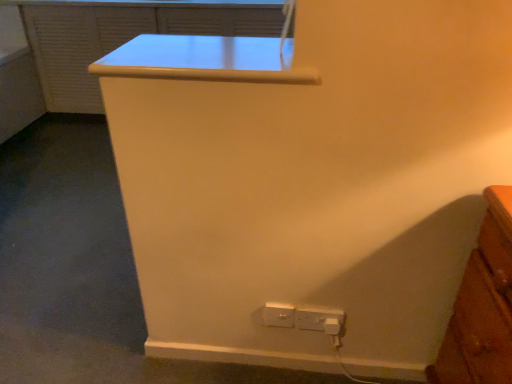
Question: Is matte white file cabinet at upper center placed right next to white plastic power plugs and sockets at lower center, acting as the first power plugs and sockets starting from the left?

Choices:
 (A) no
 (B) yes

Answer: (A)

Question: From the image's perspective, is matte white file cabinet at upper center on white plastic power plugs and sockets at lower center, acting as the first power plugs and sockets starting from the left?

Choices:
 (A) yes
 (B) no

Answer: (A)

Question: From a real-world perspective, is matte white file cabinet at upper center beneath white plastic power plugs and sockets at lower center, acting as the first power plugs and sockets starting from the left?

Choices:
 (A) no
 (B) yes

Answer: (A)

Question: Considering the relative positions of matte white file cabinet at upper center and white plastic power plugs and sockets at lower center, acting as the first power plugs and sockets starting from the left, in the image provided, is matte white file cabinet at upper center to the right of white plastic power plugs and sockets at lower center, acting as the first power plugs and sockets starting from the left, from the viewer's perspective?

Choices:
 (A) no
 (B) yes

Answer: (A)

Question: Is matte white file cabinet at upper center outside white plastic power plugs and sockets at lower center, positioned as the second power plugs and sockets in right-to-left order?

Choices:
 (A) no
 (B) yes

Answer: (B)

Question: From a real-world perspective, is white plastic power plugs and sockets at lower right, which is counted as the first power plugs and sockets, starting from the right, positioned above or below white plastic power plugs and sockets at lower center, positioned as the second power plugs and sockets in right-to-left order?

Choices:
 (A) above
 (B) below

Answer: (B)

Question: From their relative heights in the image, would you say white plastic power plugs and sockets at lower right, which is counted as the first power plugs and sockets, starting from the right, is taller or shorter than white plastic power plugs and sockets at lower center, positioned as the second power plugs and sockets in right-to-left order?

Choices:
 (A) tall
 (B) short

Answer: (B)

Question: Is white plastic power plugs and sockets at lower right, which is counted as the first power plugs and sockets, starting from the right, in front of or behind white plastic power plugs and sockets at lower center, positioned as the second power plugs and sockets in right-to-left order, in the image?

Choices:
 (A) behind
 (B) front

Answer: (B)

Question: Would you say white plastic power plugs and sockets at lower right, which is counted as the second power plugs and sockets, starting from the left, is to the left or to the right of white plastic power plugs and sockets at lower center, acting as the first power plugs and sockets starting from the left, in the picture?

Choices:
 (A) right
 (B) left

Answer: (A)

Question: Is white plastic power plugs and sockets at lower center, acting as the first power plugs and sockets starting from the left, situated inside matte white file cabinet at upper center or outside?

Choices:
 (A) inside
 (B) outside

Answer: (B)

Question: In the image, is white plastic power plugs and sockets at lower center, positioned as the second power plugs and sockets in right-to-left order, on the left side or the right side of matte white file cabinet at upper center?

Choices:
 (A) left
 (B) right

Answer: (B)

Question: Looking at the image, does white plastic power plugs and sockets at lower center, acting as the first power plugs and sockets starting from the left, seem bigger or smaller compared to matte white file cabinet at upper center?

Choices:
 (A) small
 (B) big

Answer: (A)

Question: Considering the positions of white plastic power plugs and sockets at lower center, positioned as the second power plugs and sockets in right-to-left order, and matte white file cabinet at upper center in the image, is white plastic power plugs and sockets at lower center, positioned as the second power plugs and sockets in right-to-left order, wider or thinner than matte white file cabinet at upper center?

Choices:
 (A) wide
 (B) thin

Answer: (B)

Question: From the image's perspective, is white plastic power plugs and sockets at lower center, positioned as the second power plugs and sockets in right-to-left order, above or below white plastic power plugs and sockets at lower right, which is counted as the second power plugs and sockets, starting from the left?

Choices:
 (A) below
 (B) above

Answer: (B)

Question: Is white plastic power plugs and sockets at lower center, acting as the first power plugs and sockets starting from the left, inside or outside of white plastic power plugs and sockets at lower right, which is counted as the first power plugs and sockets, starting from the right?

Choices:
 (A) inside
 (B) outside

Answer: (B)